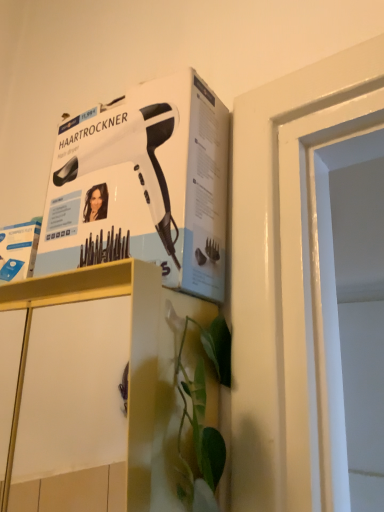
Question: Is matte gold cabinet at lower center positioned with its back to white matte hair dryer at upper left?

Choices:
 (A) yes
 (B) no

Answer: (B)

Question: Is matte gold cabinet at lower center positioned far away from white matte hair dryer at upper left?

Choices:
 (A) yes
 (B) no

Answer: (B)

Question: Would you say matte gold cabinet at lower center contains white matte hair dryer at upper left?

Choices:
 (A) yes
 (B) no

Answer: (B)

Question: Is matte gold cabinet at lower center facing towards white matte hair dryer at upper left?

Choices:
 (A) yes
 (B) no

Answer: (B)

Question: From the image's perspective, would you say matte gold cabinet at lower center is positioned over white matte hair dryer at upper left?

Choices:
 (A) yes
 (B) no

Answer: (B)

Question: Is matte gold cabinet at lower center next to white matte hair dryer at upper left and touching it?

Choices:
 (A) yes
 (B) no

Answer: (B)

Question: Is white matte hair dryer at upper left positioned behind matte gold cabinet at lower center?

Choices:
 (A) yes
 (B) no

Answer: (A)

Question: From a real-world perspective, is white matte hair dryer at upper left beneath matte gold cabinet at lower center?

Choices:
 (A) no
 (B) yes

Answer: (A)

Question: Is white matte hair dryer at upper left positioned beyond the bounds of matte gold cabinet at lower center?

Choices:
 (A) no
 (B) yes

Answer: (B)

Question: Does white matte hair dryer at upper left have a lesser height compared to matte gold cabinet at lower center?

Choices:
 (A) no
 (B) yes

Answer: (B)

Question: Is white matte hair dryer at upper left facing towards matte gold cabinet at lower center?

Choices:
 (A) yes
 (B) no

Answer: (B)

Question: Is white matte hair dryer at upper left thinner than matte gold cabinet at lower center?

Choices:
 (A) no
 (B) yes

Answer: (B)

Question: Looking at the image, does matte gold cabinet at lower center seem bigger or smaller compared to white matte hair dryer at upper left?

Choices:
 (A) big
 (B) small

Answer: (A)